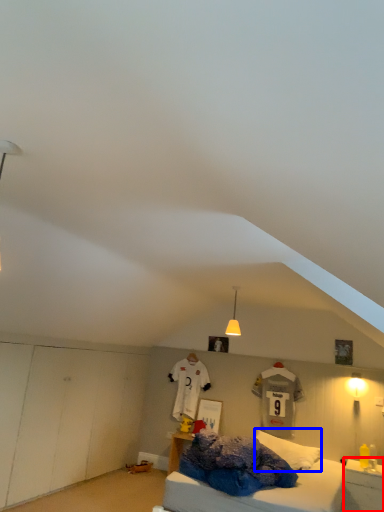
Question: Which point is closer to the camera, nightstand (highlighted by a red box) or pillow (highlighted by a blue box)?

Choices:
 (A) nightstand
 (B) pillow

Answer: (A)